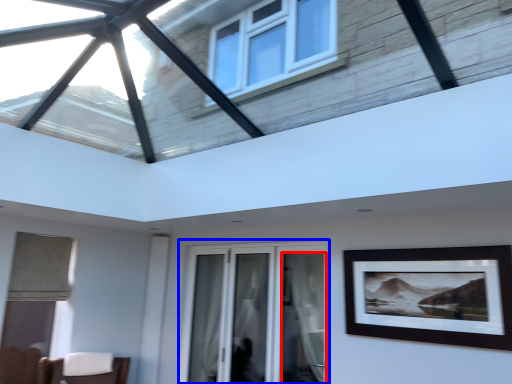
Question: Which object is further to the camera taking this photo, curtain (highlighted by a red box) or window (highlighted by a blue box)?

Choices:
 (A) curtain
 (B) window

Answer: (B)